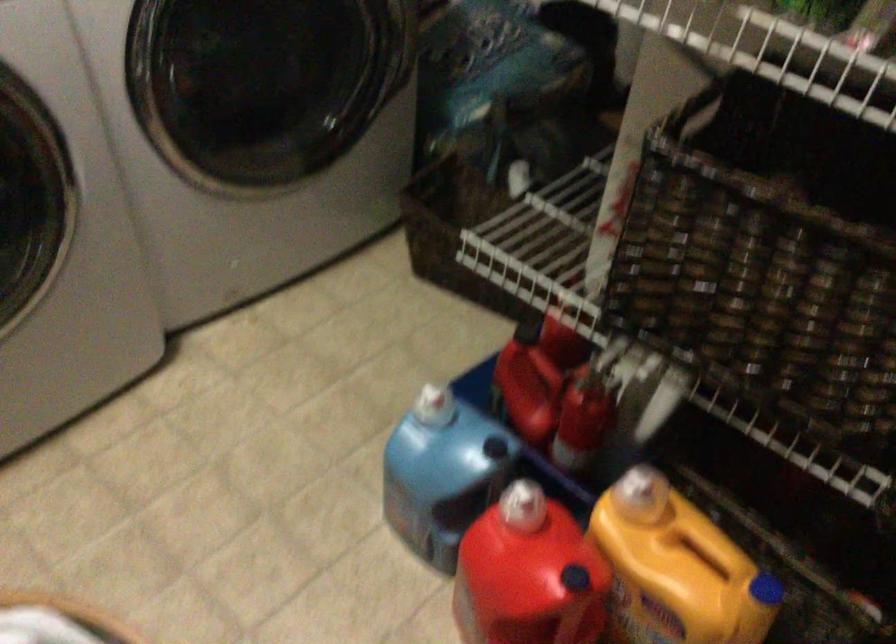
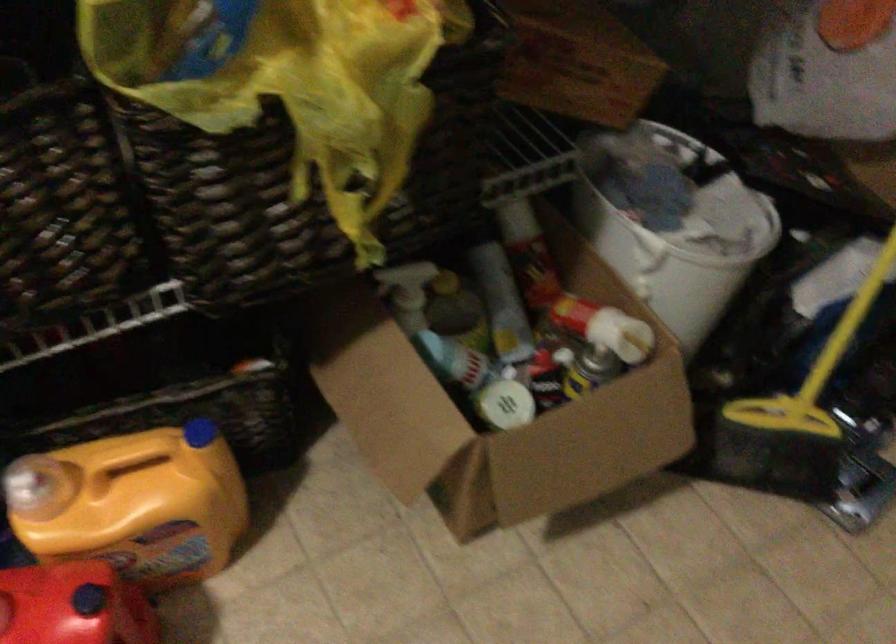
The point at (669, 573) is marked in the first image. Where is the corresponding point in the second image?

(133, 504)